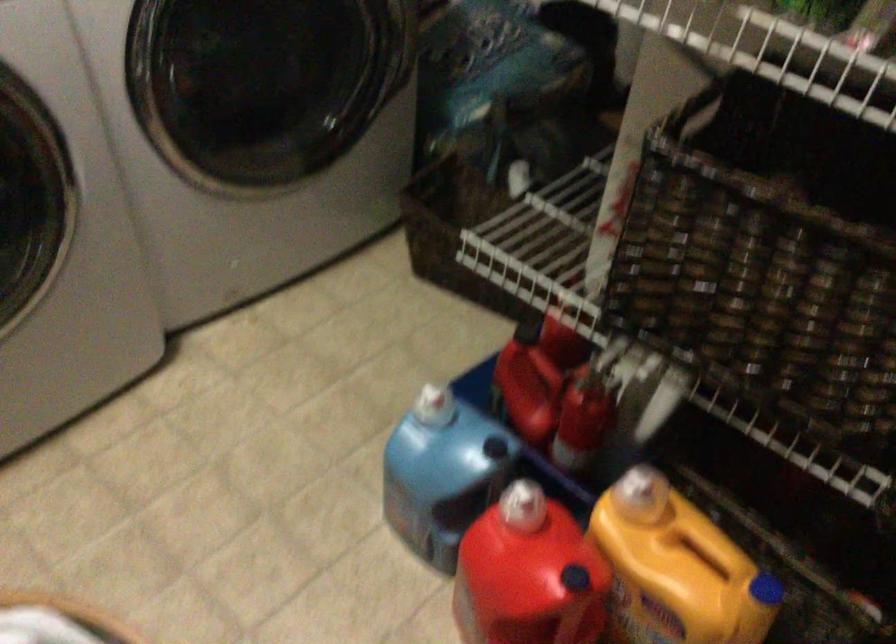
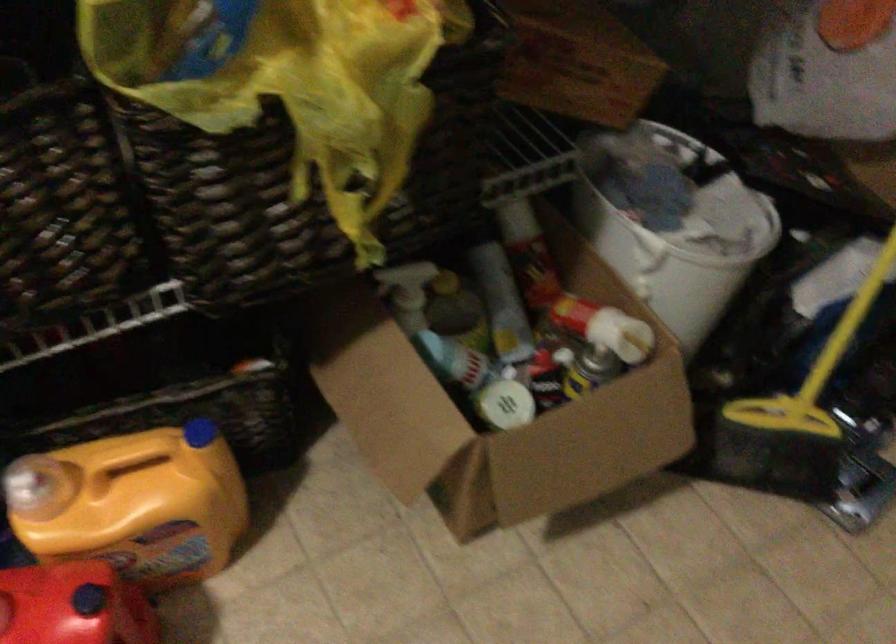
The point at (669, 573) is marked in the first image. Where is the corresponding point in the second image?

(133, 504)